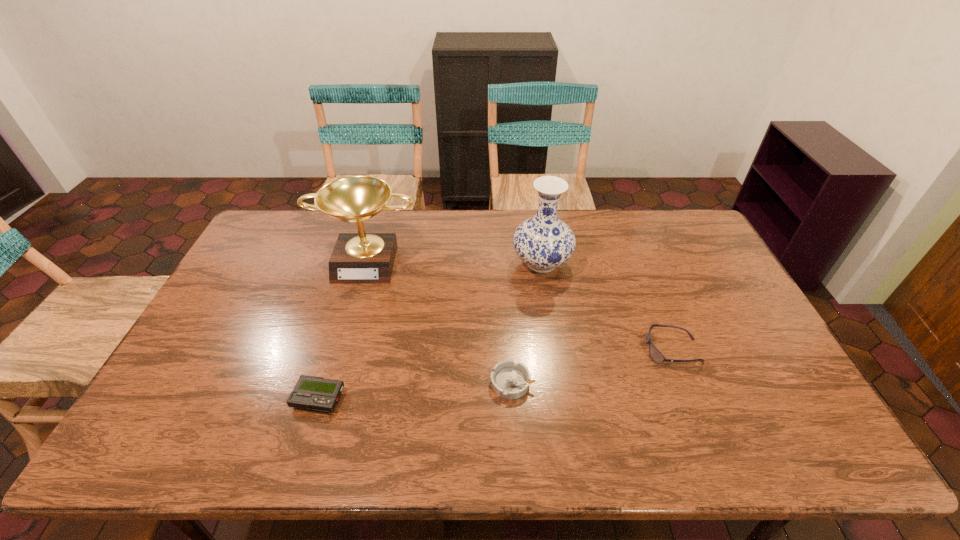
Locate an element on the screen. object that is the fourth closest to the award is located at coordinates (654, 353).

What are the coordinates of `free location that satisfies the following two spatial constraints: 1. on the front-facing side of the vase; 2. on the left side of the award` in the screenshot? It's located at (367, 263).

The height and width of the screenshot is (540, 960). Find the location of `free space that satisfies the following two spatial constraints: 1. on the front-facing side of the vase; 2. on the right side of the second tallest object`. free space that satisfies the following two spatial constraints: 1. on the front-facing side of the vase; 2. on the right side of the second tallest object is located at coordinates coord(367,263).

I want to click on vacant space that satisfies the following two spatial constraints: 1. on the front-facing side of the award; 2. on the left side of the vase, so click(x=367, y=263).

Find the location of a particular element. The height and width of the screenshot is (540, 960). free space that satisfies the following two spatial constraints: 1. on the front-facing side of the second tallest object; 2. on the left side of the tallest object is located at coordinates (367, 263).

Locate an element on the screen. The width and height of the screenshot is (960, 540). free location that satisfies the following two spatial constraints: 1. on the lenses of the third tallest object; 2. on the front side of the beeper is located at coordinates (691, 398).